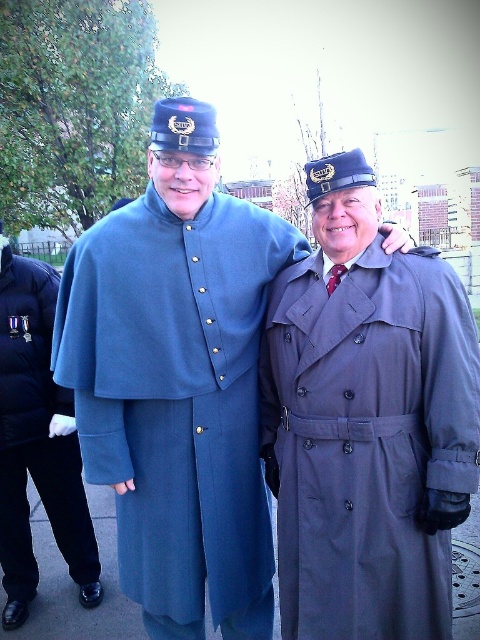
You are standing in the street scene and want to take a photo of the gray matte trench coat at right. Based on its position, which direction should you move to get it centered in your camera view?

The gray matte trench coat at right is located at point 0.661 on the x and 0.765 on the y coordinates. To center it, move to the left slightly and down a bit to adjust the camera angle accordingly.

You are standing in the street scene shown in the image and want to place a small flowerpot between the two points labeled point (338,179) and point (70,436). Which point should the flowerpot be closer to in order to be nearer to the viewer?

The flowerpot should be placed closer to point (338,179) because it is nearer to the viewer compared to point (70,436).